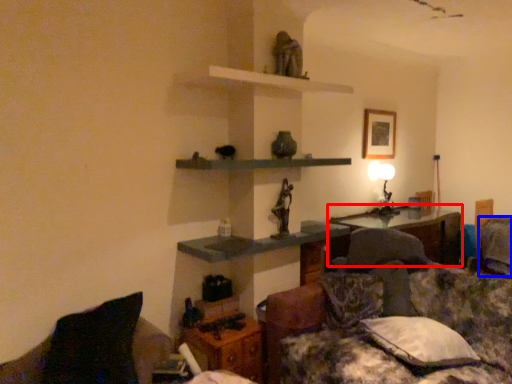
Question: Which of the following is the closest to the observer, table (highlighted by a red box) or pillow (highlighted by a blue box)?

Choices:
 (A) table
 (B) pillow

Answer: (A)